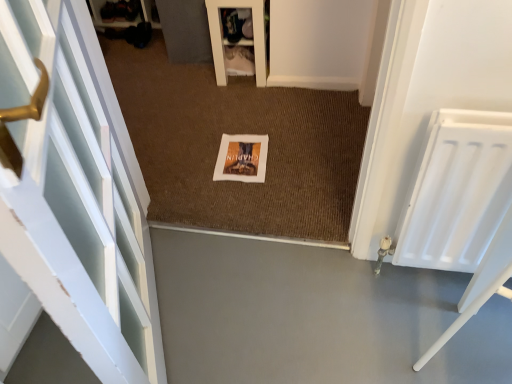
Question: Is brown textured mat at center inside or outside of white fabric shoe rack at upper center?

Choices:
 (A) inside
 (B) outside

Answer: (B)

Question: From their relative heights in the image, would you say brown textured mat at center is taller or shorter than white fabric shoe rack at upper center?

Choices:
 (A) tall
 (B) short

Answer: (B)

Question: Which object is the farthest from the gray smooth concrete at center?

Choices:
 (A) brown textured mat at center
 (B) white matte radiator at right
 (C) white fabric shoe rack at upper center
 (D) white painted wood door at left
 (E) white matte picture frame at center

Answer: (C)

Question: Estimate the real-world distances between objects in this image. Which object is closer to the brown textured mat at center?

Choices:
 (A) white fabric shoe rack at upper center
 (B) white matte radiator at right
 (C) white painted wood door at left
 (D) white matte picture frame at center
 (E) gray smooth concrete at center

Answer: (D)